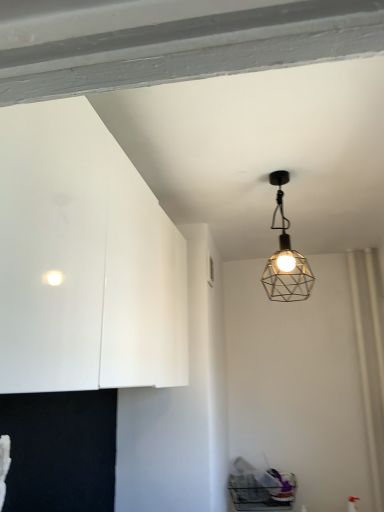
Question: Is white glossy cabinet at left aimed at metallic wireframe lamp at upper center?

Choices:
 (A) no
 (B) yes

Answer: (B)

Question: Is white glossy cabinet at left not near metallic wireframe lamp at upper center?

Choices:
 (A) yes
 (B) no

Answer: (B)

Question: From a real-world perspective, is white glossy cabinet at left physically above metallic wireframe lamp at upper center?

Choices:
 (A) yes
 (B) no

Answer: (B)

Question: Is white glossy cabinet at left looking in the opposite direction of metallic wireframe lamp at upper center?

Choices:
 (A) no
 (B) yes

Answer: (A)

Question: Is the depth of white glossy cabinet at left greater than that of metallic wireframe lamp at upper center?

Choices:
 (A) yes
 (B) no

Answer: (B)

Question: Does white glossy cabinet at left lie in front of metallic wireframe lamp at upper center?

Choices:
 (A) no
 (B) yes

Answer: (B)

Question: Is metallic wireframe lamp at upper center smaller than white glossy cabinet at left?

Choices:
 (A) no
 (B) yes

Answer: (B)

Question: Can you confirm if metallic wireframe lamp at upper center is thinner than white glossy cabinet at left?

Choices:
 (A) yes
 (B) no

Answer: (A)

Question: Can you confirm if metallic wireframe lamp at upper center is wider than white glossy cabinet at left?

Choices:
 (A) no
 (B) yes

Answer: (A)

Question: Is metallic wireframe lamp at upper center far away from white glossy cabinet at left?

Choices:
 (A) no
 (B) yes

Answer: (A)

Question: Is metallic wireframe lamp at upper center oriented towards white glossy cabinet at left?

Choices:
 (A) yes
 (B) no

Answer: (B)

Question: Would you say white glossy cabinet at left is part of metallic wireframe lamp at upper center's contents?

Choices:
 (A) yes
 (B) no

Answer: (B)

Question: From the image's perspective, is white glossy cabinet at left located above or below metallic wireframe lamp at upper center?

Choices:
 (A) below
 (B) above

Answer: (A)